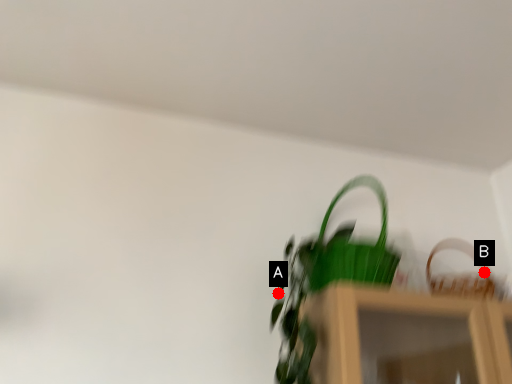
Question: Two points are circled on the image, labeled by A and B beside each circle. Which point appears closest to the camera in this image?

Choices:
 (A) A is closer
 (B) B is closer

Answer: (A)